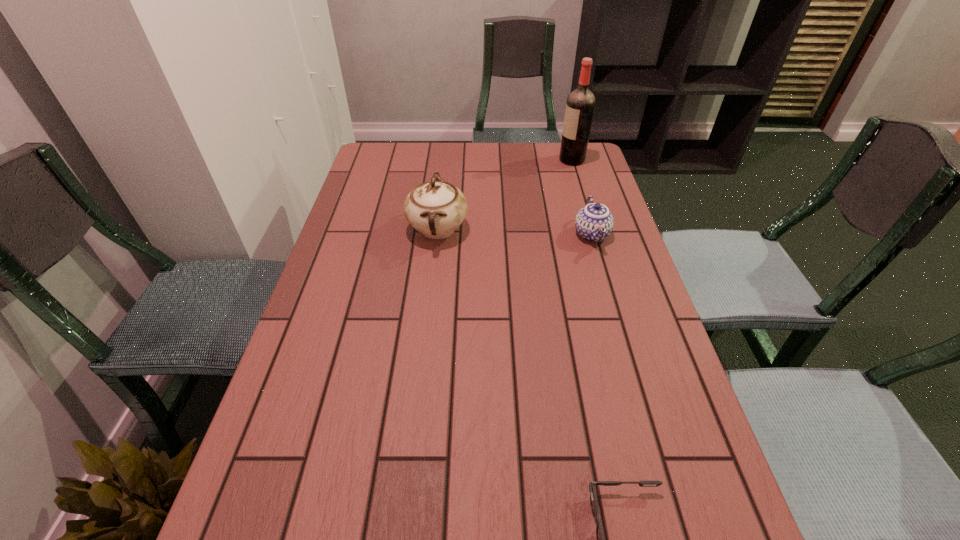
At what (x,y) coordinates should I click in order to perform the action: click on free space that is in between the second tallest object and the tallest object. Please return your answer as a coordinate pair (x, y). This screenshot has width=960, height=540. Looking at the image, I should click on (505, 194).

Select which object is the closest to the left chinaware. Please provide its 2D coordinates. Your answer should be formatted as a tuple, i.e. [(x, y)], where the tuple contains the x and y coordinates of a point satisfying the conditions above.

[(594, 222)]

Locate which object is the second closest to the shorter chinaware. Please provide its 2D coordinates. Your answer should be formatted as a tuple, i.e. [(x, y)], where the tuple contains the x and y coordinates of a point satisfying the conditions above.

[(436, 208)]

What are the coordinates of `vacant region that satisfies the following two spatial constraints: 1. on the front-facing side of the liquor; 2. from the spout of the right chinaware` in the screenshot? It's located at (594, 234).

Identify the location of free space that satisfies the following two spatial constraints: 1. on the front-facing side of the farthest object; 2. from the spout of the shorter chinaware. Image resolution: width=960 pixels, height=540 pixels. (594, 234).

This screenshot has height=540, width=960. I want to click on free space in the image that satisfies the following two spatial constraints: 1. on the front-facing side of the liquor; 2. from the spout of the third tallest object, so click(594, 234).